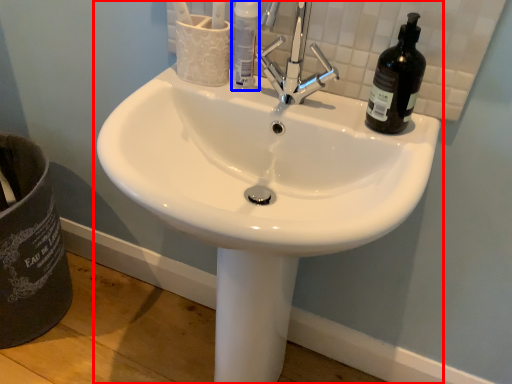
Question: Among these objects, which one is nearest to the camera, sink (highlighted by a red box) or bottle (highlighted by a blue box)?

Choices:
 (A) sink
 (B) bottle

Answer: (A)